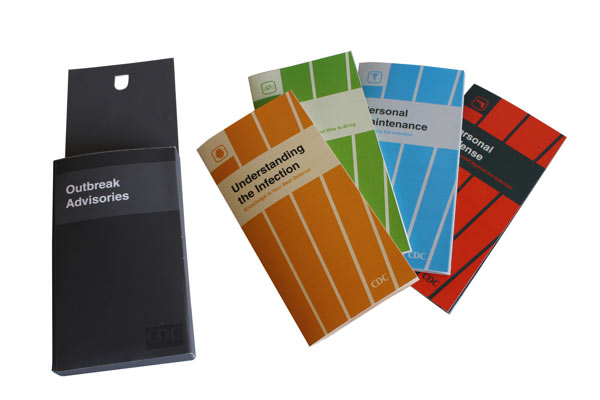
Locate an element on the screen. This screenshot has width=600, height=400. books is located at coordinates (312, 219), (365, 168), (424, 163), (474, 213).